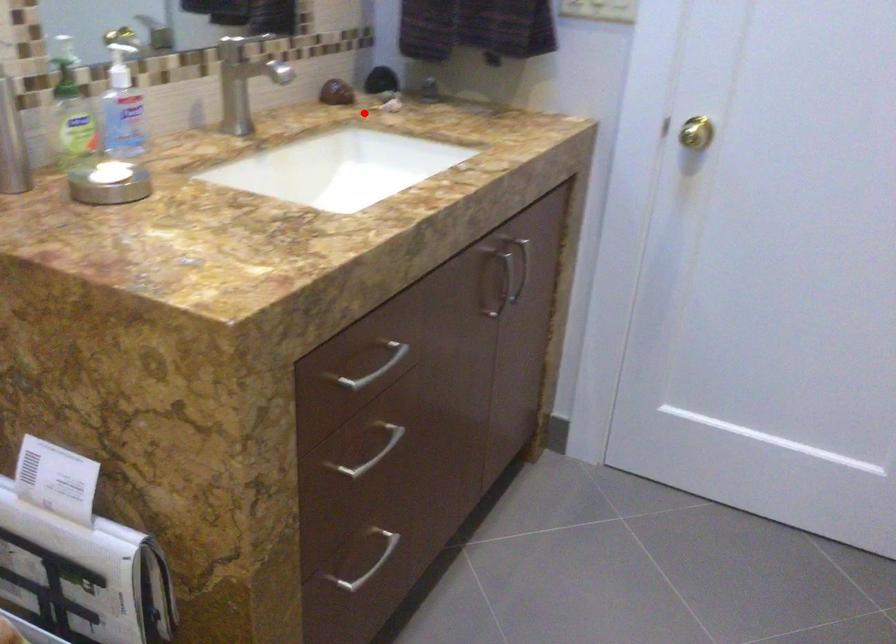
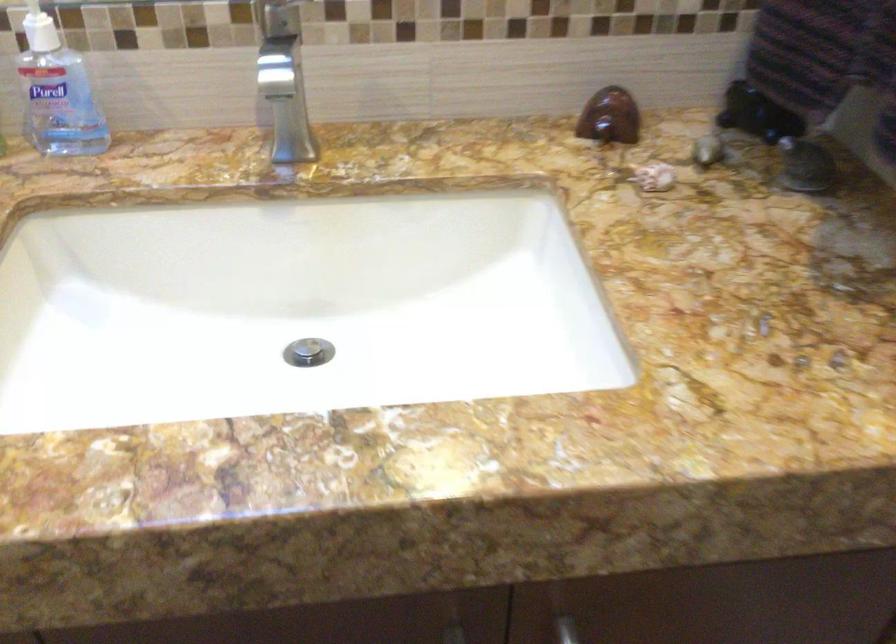
Question: I am providing you with two images of the same scene from different viewpoints. Given a red point in image1, look at the same physical point in image2. Is it:

Choices:
 (A) Closer to the viewpoint
 (B) Farther from the viewpoint

Answer: (A)